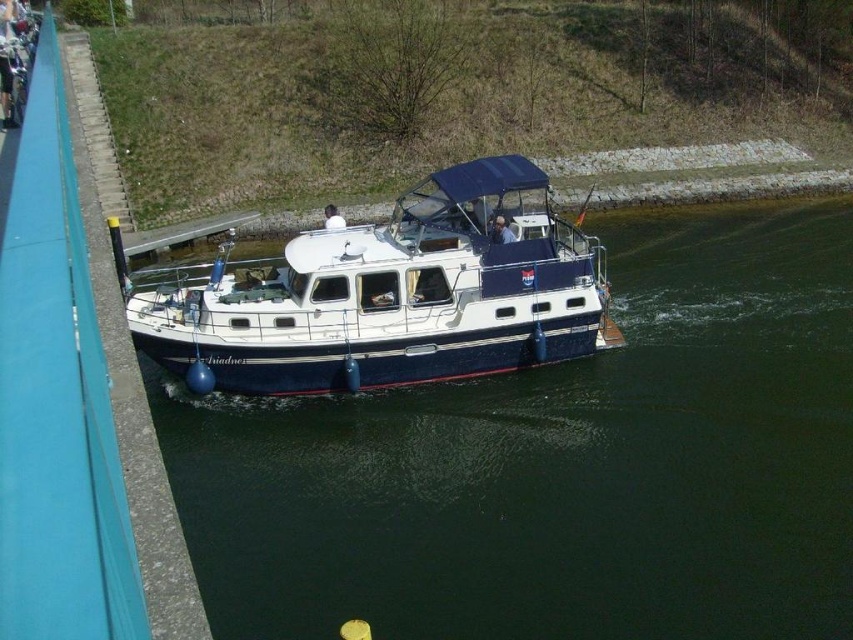
Based on the photo, you are standing on the pier and want to take a photo of the boat. You notice two points marked on the boat, one at point [469,588] and another at point [512,240]. Which point will appear larger in your photo?

Point [469,588] will appear larger in the photo because it is closer to the camera than point [512,240].

You are standing on the pier and see the dark blue water at center and the matte white shirt at center. Which object is closer to you?

The dark blue water at center is closer to you because it is in front of the matte white shirt at center.

You are a photographer planning to take a photo of the dark blue water at center and the matte white shirt at center from the pier. Based on their sizes in the scene, which object should you focus on first to ensure both are in frame?

The dark blue water at center has a larger width than the matte white shirt at center, so you should focus on the dark blue water at center first to ensure both fit within the frame.